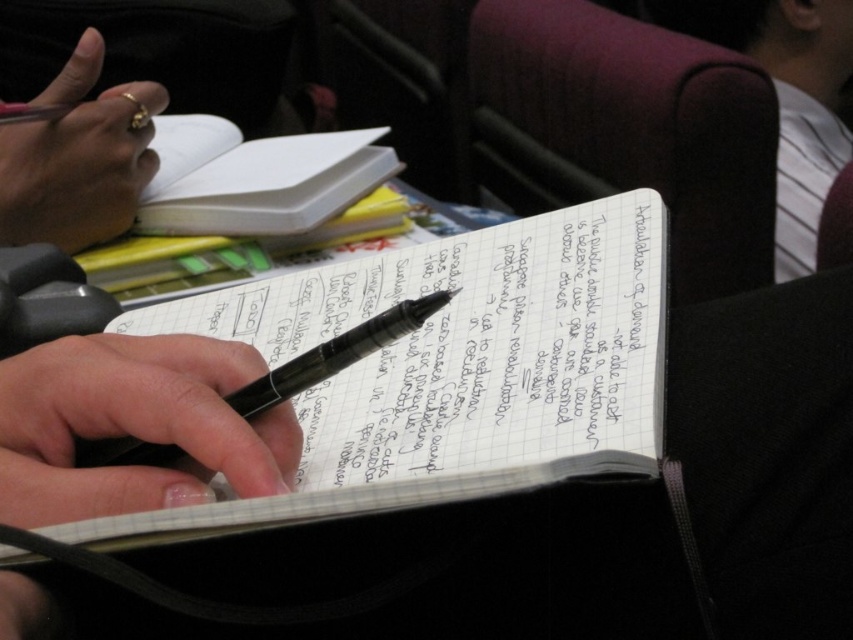
Is gold ring at upper left bigger than white paper notebook at upper center?

No, gold ring at upper left is not bigger than white paper notebook at upper center.

Is gold ring at upper left smaller than white paper notebook at upper center?

Correct, gold ring at upper left occupies less space than white paper notebook at upper center.

This screenshot has width=853, height=640. What do you see at coordinates (79, 170) in the screenshot?
I see `gold ring at upper left` at bounding box center [79, 170].

The image size is (853, 640). I want to click on gold ring at upper left, so click(79, 170).

In the scene shown: Is black matte pen at center smaller than black glossy pen at center?

Yes.

Who is more forward, (47, 497) or (151, 458)?

Point (47, 497) is more forward.

Find the location of a particular element. The height and width of the screenshot is (640, 853). black matte pen at center is located at coordinates (132, 426).

I want to click on black matte pen at center, so click(132, 426).

Who is taller, white paper notebook at upper center or black glossy pen at center?

white paper notebook at upper center is taller.

Does white paper notebook at upper center have a smaller size compared to black glossy pen at center?

Incorrect, white paper notebook at upper center is not smaller in size than black glossy pen at center.

Is point (254, 200) in front of point (229, 401)?

No, (254, 200) is behind (229, 401).

At what (x,y) coordinates should I click in order to perform the action: click on white paper notebook at upper center. Please return your answer as a coordinate pair (x, y). Looking at the image, I should click on (271, 186).